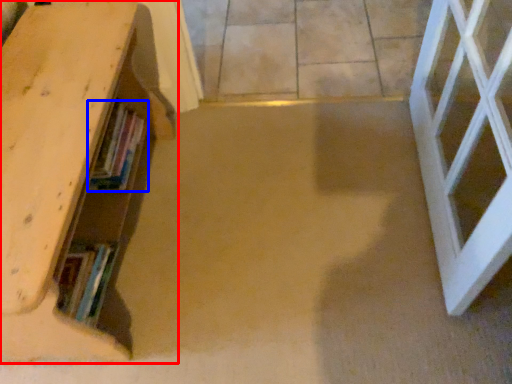
Question: Which of the following is the farthest to the observer, shelf (highlighted by a red box) or book (highlighted by a blue box)?

Choices:
 (A) shelf
 (B) book

Answer: (B)